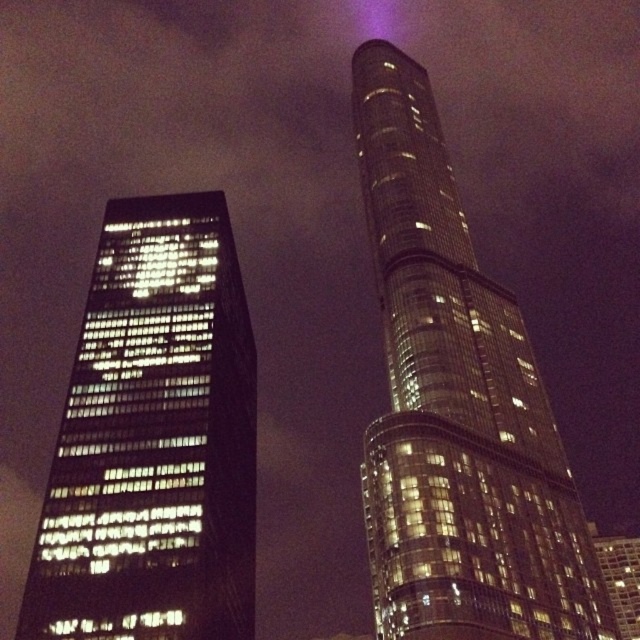
Does glossy glass tower at upper center come behind black glass building at left?

No, glossy glass tower at upper center is in front of black glass building at left.

Can you confirm if glossy glass tower at upper center is positioned to the left of black glass building at left?

In fact, glossy glass tower at upper center is to the right of black glass building at left.

This screenshot has width=640, height=640. I want to click on glossy glass tower at upper center, so click(x=456, y=406).

You are a GUI agent. You are given a task and a screenshot of the screen. Output one action in this format:
    pyautogui.click(x=<x>, y=<y>)
    Task: Click on the glossy glass tower at upper center
    This screenshot has height=640, width=640.
    Given the screenshot: What is the action you would take?
    [x=456, y=406]